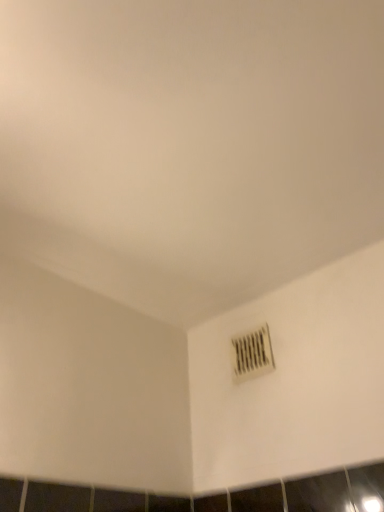
Locate an element on the screen. The image size is (384, 512). white plastic air conditioning at lower right is located at coordinates (252, 354).

The width and height of the screenshot is (384, 512). Describe the element at coordinates (252, 354) in the screenshot. I see `white plastic air conditioning at lower right` at that location.

Image resolution: width=384 pixels, height=512 pixels. What are the coordinates of `white plastic air conditioning at lower right` in the screenshot? It's located at (252, 354).